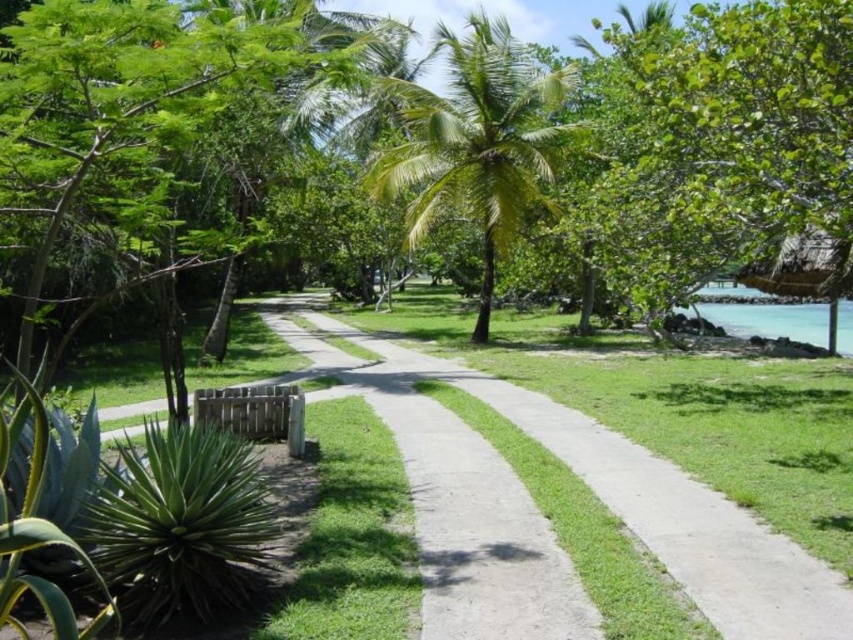
You are a drone operator trying to capture a photo of the thatched roof hut at upper right. Your drone is currently hovering above the gray concrete path at center. Can you safely fly the drone straight towards the hut without any obstacles blocking the path?

The gray concrete path at center is much taller than the thatched roof hut at upper right, so flying the drone straight towards the hut from above the path might be possible since the path is elevated higher. However, the description does not mention any obstacles between them, so it should be safe.

You are a delivery person trying to reach the thatched roof hut at upper right. Based on the scene, which direction should you walk along the gray concrete path at center to reach it?

The gray concrete path at center is below the thatched roof hut at upper right, so you should walk upwards along the gray concrete path at center towards the upper right direction to reach the thatched roof hut at upper right.

You are a landscape architect designing a walking path and need to place a green leafy palm tree at center and a thatched roof hut at upper right. Given the space constraints, which object requires more horizontal space?

The thatched roof hut at upper right requires more horizontal space because its width is greater than the green leafy palm tree at center.